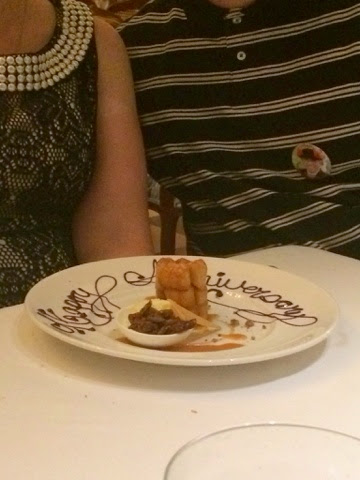
I want to click on plate, so click(276, 343).